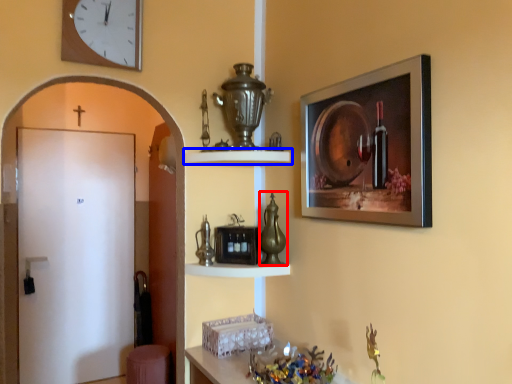
Question: Which point is closer to the camera, glass vase (highlighted by a red box) or shelf (highlighted by a blue box)?

Choices:
 (A) glass vase
 (B) shelf

Answer: (B)